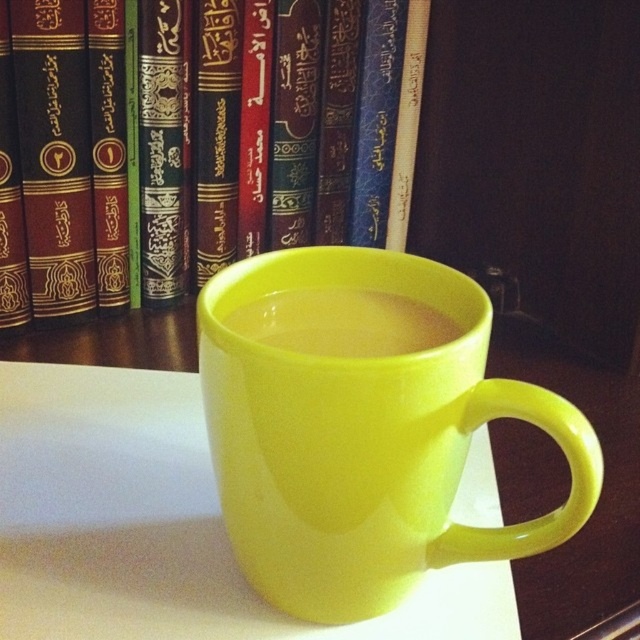
Question: Is matte black book at center above translucent plastic liquid at center?

Choices:
 (A) no
 (B) yes

Answer: (B)

Question: Can you confirm if matte black book at center is positioned below glossy ceramic mug at center?

Choices:
 (A) yes
 (B) no

Answer: (B)

Question: Does matte black book at center lie in front of glossy ceramic mug at center?

Choices:
 (A) yes
 (B) no

Answer: (B)

Question: Which of the following is the farthest from the observer?

Choices:
 (A) (401, 545)
 (B) (128, 76)

Answer: (B)

Question: Estimate the real-world distances between objects in this image. Which object is closer to the glossy ceramic mug at center?

Choices:
 (A) translucent plastic liquid at center
 (B) matte black book at center

Answer: (A)

Question: Which of the following is the closest to the observer?

Choices:
 (A) matte black book at center
 (B) translucent plastic liquid at center
 (C) glossy ceramic mug at center

Answer: (C)